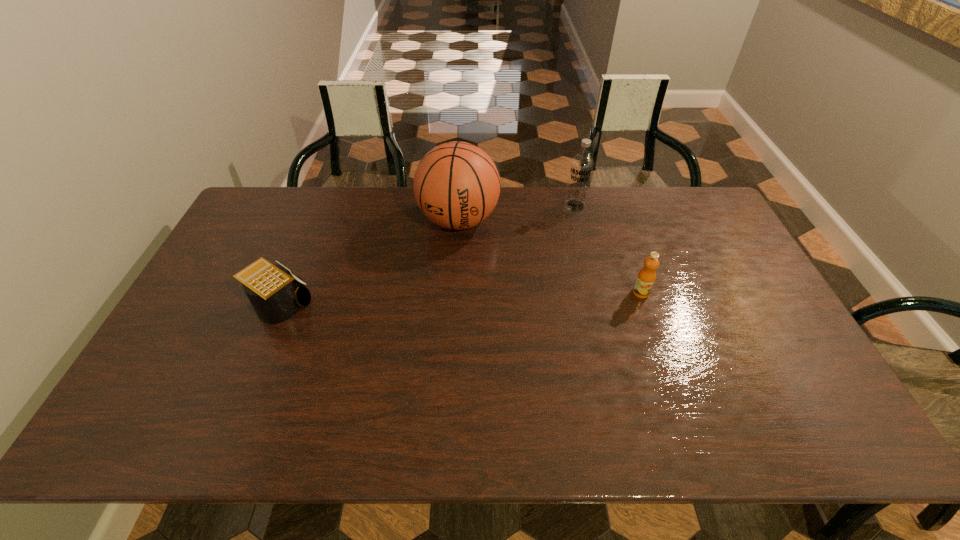
The width and height of the screenshot is (960, 540). I want to click on calculator, so click(x=275, y=294).

Find the location of `the shortest object`. the shortest object is located at coordinates 275,294.

Locate an element on the screen. the third tallest object is located at coordinates (646, 277).

The width and height of the screenshot is (960, 540). Identify the location of orange juice. (646, 277).

You are a GUI agent. You are given a task and a screenshot of the screen. Output one action in this format:
    pyautogui.click(x=<x>, y=<y>)
    Task: Click on the basketball
    The height and width of the screenshot is (540, 960).
    Given the screenshot: What is the action you would take?
    pyautogui.click(x=456, y=185)

The height and width of the screenshot is (540, 960). What are the coordinates of `vodka` in the screenshot? It's located at (581, 166).

The height and width of the screenshot is (540, 960). Identify the location of free space located 0.380m on the back of the calculator. (321, 206).

This screenshot has height=540, width=960. What are the coordinates of `free spot located on the front label of the rightmost object` in the screenshot? It's located at click(669, 375).

At what (x,y) coordinates should I click in order to perform the action: click on blank area located on the surface of the basketball near the brand logo. Please return your answer as a coordinate pair (x, y). The height and width of the screenshot is (540, 960). Looking at the image, I should click on 447,267.

Where is `vacant space located on the surface of the basketball near the brand logo`? The height and width of the screenshot is (540, 960). vacant space located on the surface of the basketball near the brand logo is located at coordinates (438, 303).